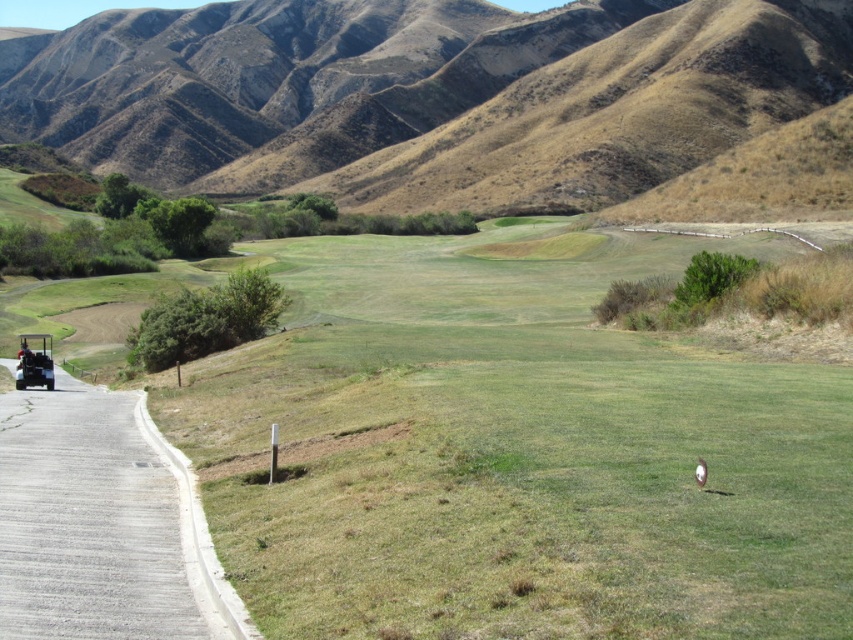
Which is more to the left, green grassy field at center or metallic golf cart at left?

Positioned to the left is metallic golf cart at left.

Is point (811, 358) closer to viewer compared to point (36, 362)?

Yes.

Between point (769, 509) and point (30, 364), which one is positioned behind?

The point (30, 364) is behind.

I want to click on green grassy field at center, so click(515, 451).

Is brown/dry grassy at upper center to the left of metallic golf cart at left from the viewer's perspective?

Yes, brown/dry grassy at upper center is to the left of metallic golf cart at left.

Between point (199, 124) and point (27, 355), which one is positioned in front?

Positioned in front is point (27, 355).

Find the location of `brown/dry grassy at upper center`. brown/dry grassy at upper center is located at coordinates (422, 93).

In the scene shown: Measure the distance between green grassy field at center and camera.

8.57 meters

Who is more forward, (x=207, y=390) or (x=479, y=100)?

Point (x=207, y=390) is in front.

Locate an element on the screen. Image resolution: width=853 pixels, height=640 pixels. green grassy field at center is located at coordinates (515, 451).